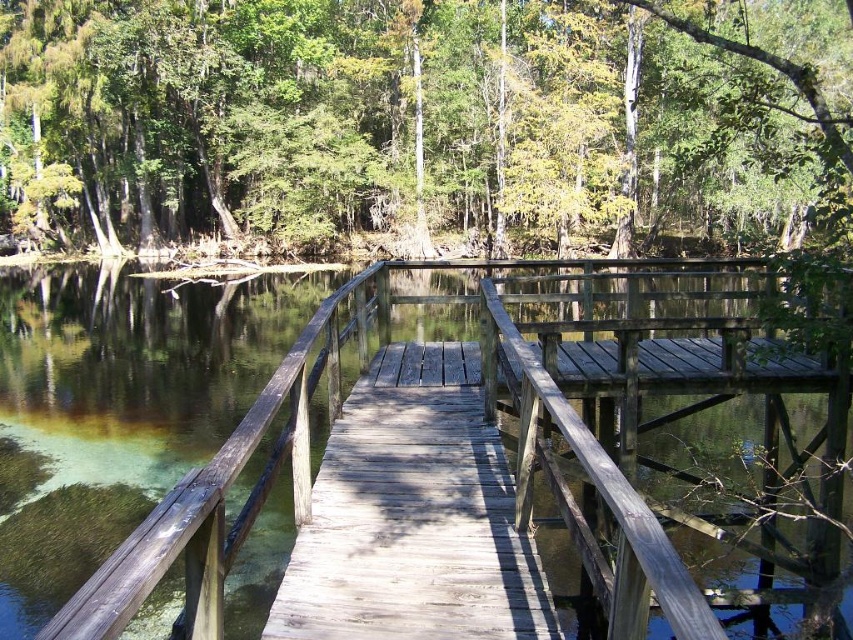
Question: Can you confirm if green matte tree at upper center is positioned to the left of weathered wood bridge at center?

Choices:
 (A) yes
 (B) no

Answer: (A)

Question: Is green matte tree at upper center thinner than weathered wood bridge at center?

Choices:
 (A) yes
 (B) no

Answer: (B)

Question: Can you confirm if green matte tree at upper center is positioned above weathered wood bridge at center?

Choices:
 (A) no
 (B) yes

Answer: (B)

Question: Which of the following is the farthest from the observer?

Choices:
 (A) weathered wood bridge at center
 (B) green matte tree at upper center

Answer: (B)